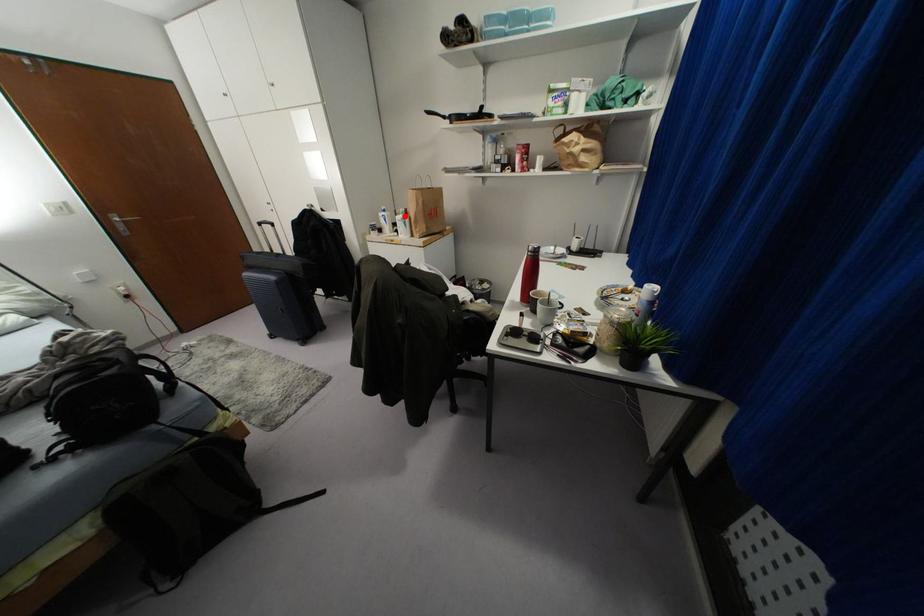
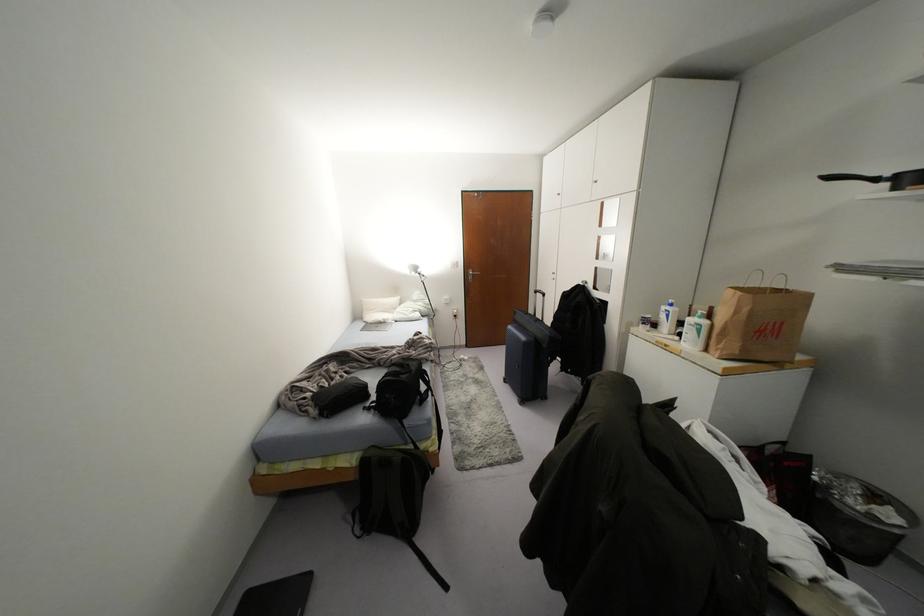
Locate, in the second image, the point that corresponds to the highlighted location in the first image.

(703, 322)